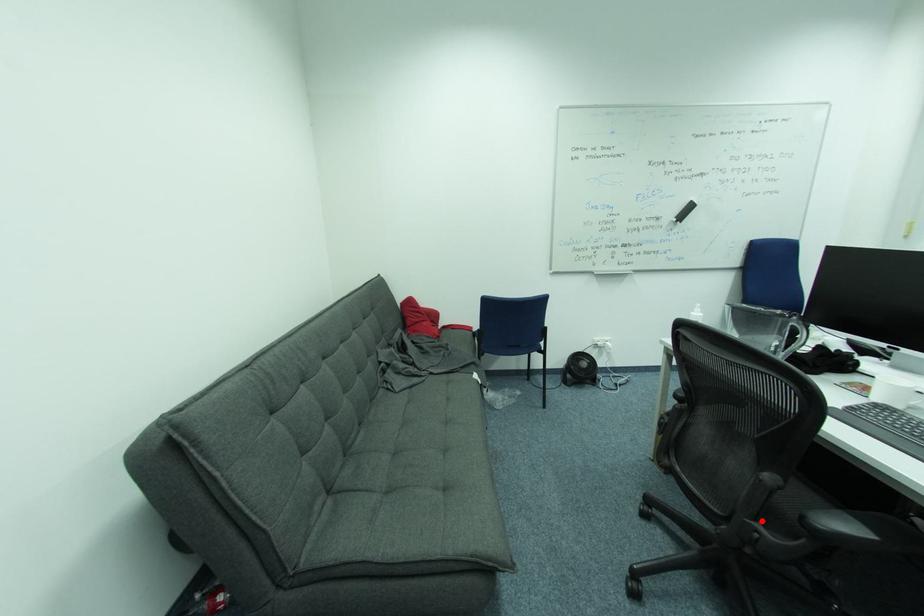
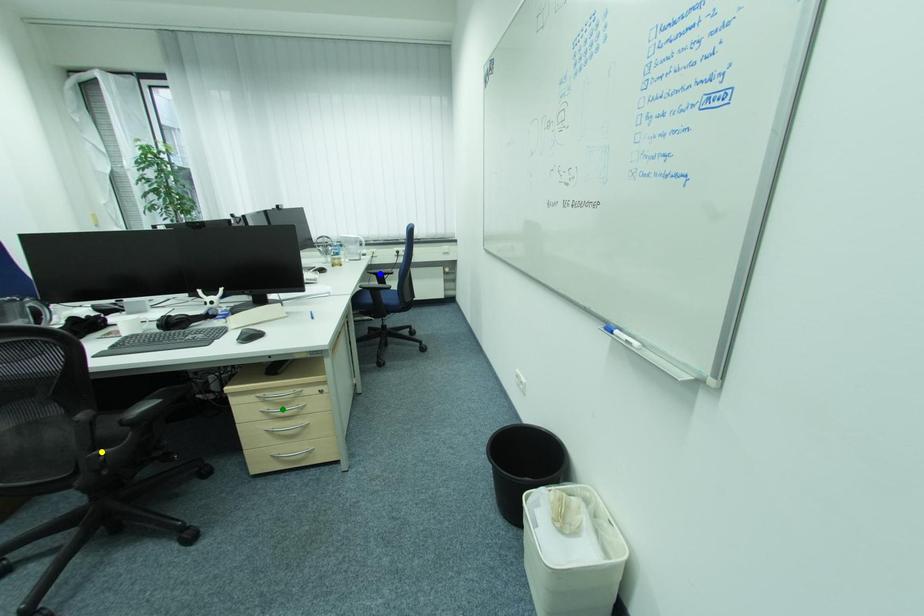
Question: I am providing you with two images of the same scene from different viewpoints. A red point is marked on the first image. You are given multiple points on the second image. Which spot in image 2 lines up with the point in image 1?

Choices:
 (A) yellow point
 (B) green point
 (C) blue point

Answer: (A)